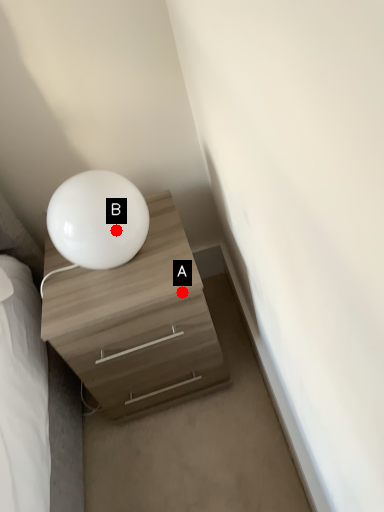
Question: Two points are circled on the image, labeled by A and B beside each circle. Which point is farther from the camera taking this photo?

Choices:
 (A) A is further
 (B) B is further

Answer: (A)